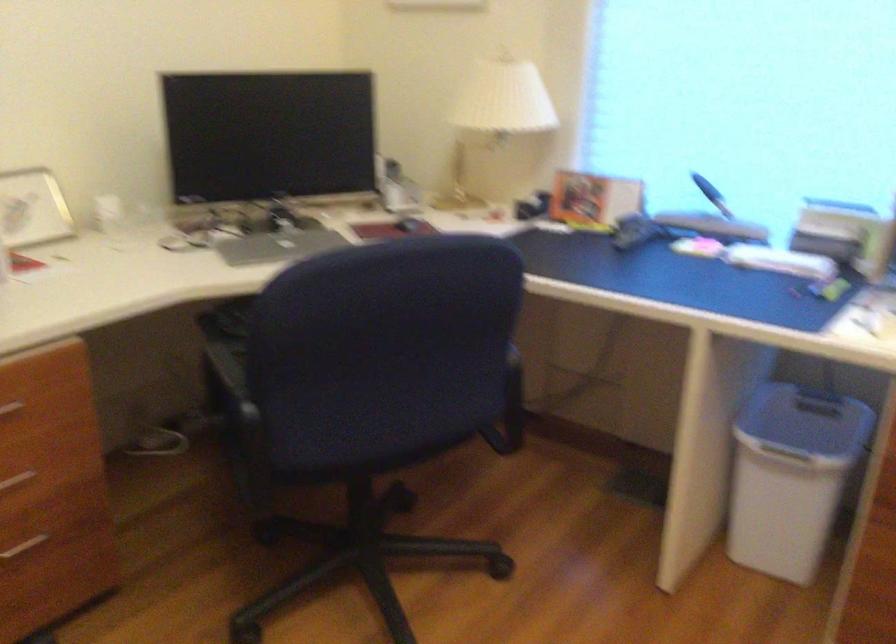
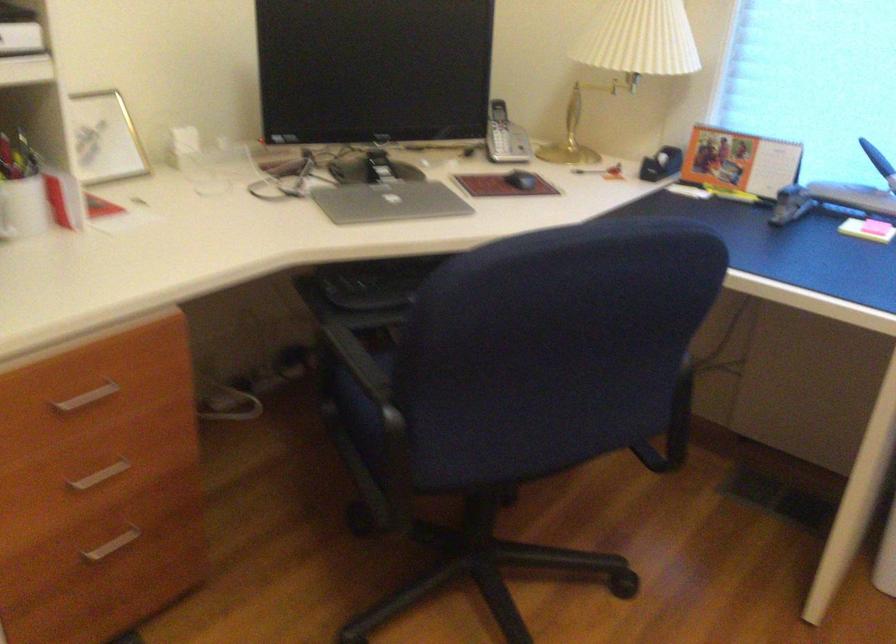
Where in the second image is the point corresponding to point 405,223 from the first image?

(521, 180)